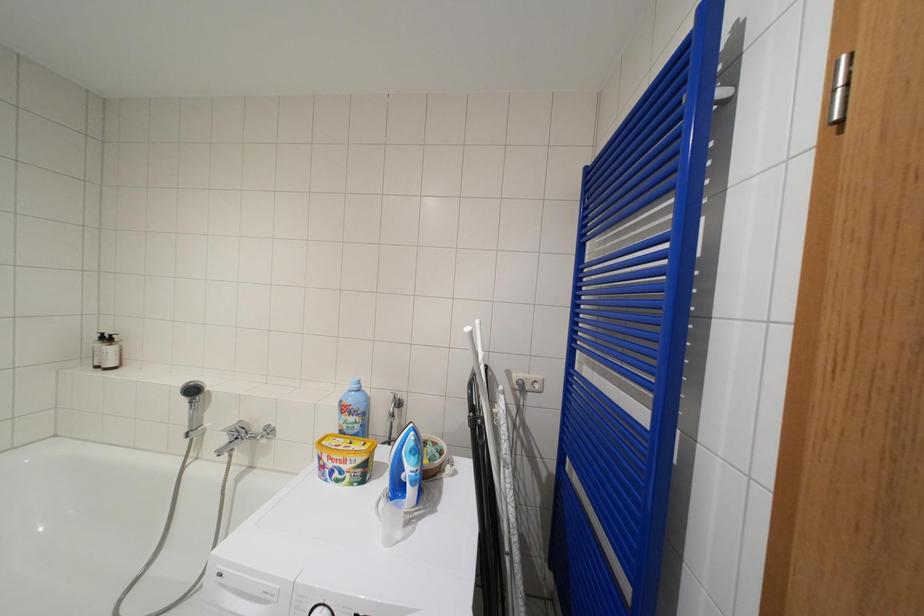
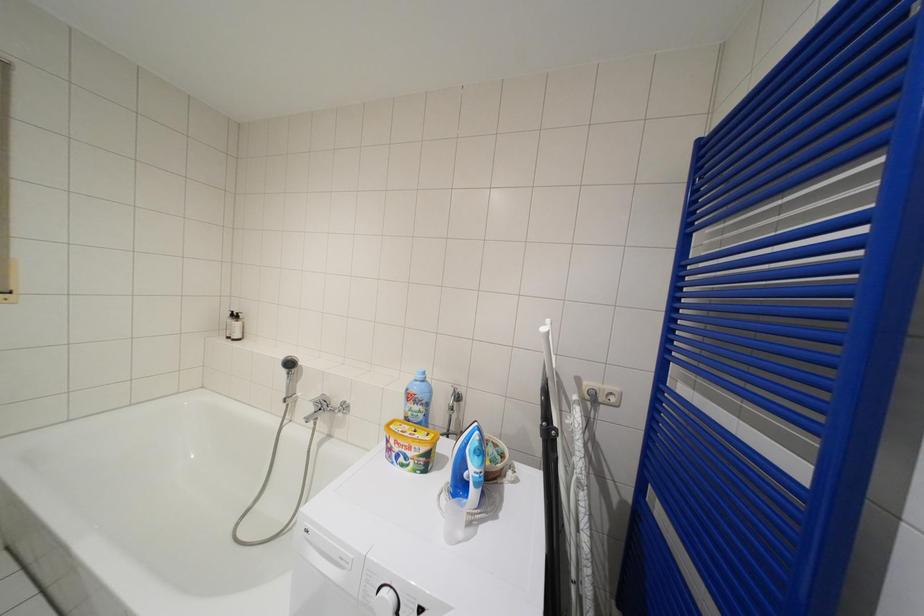
In a continuous first-person perspective shot, in which direction is the camera moving?

The cameraman walked toward left, forward.